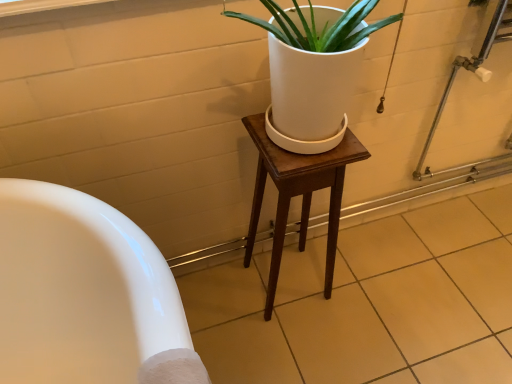
Identify the location of vacant point to the right of wooden stool at center. (359, 292).